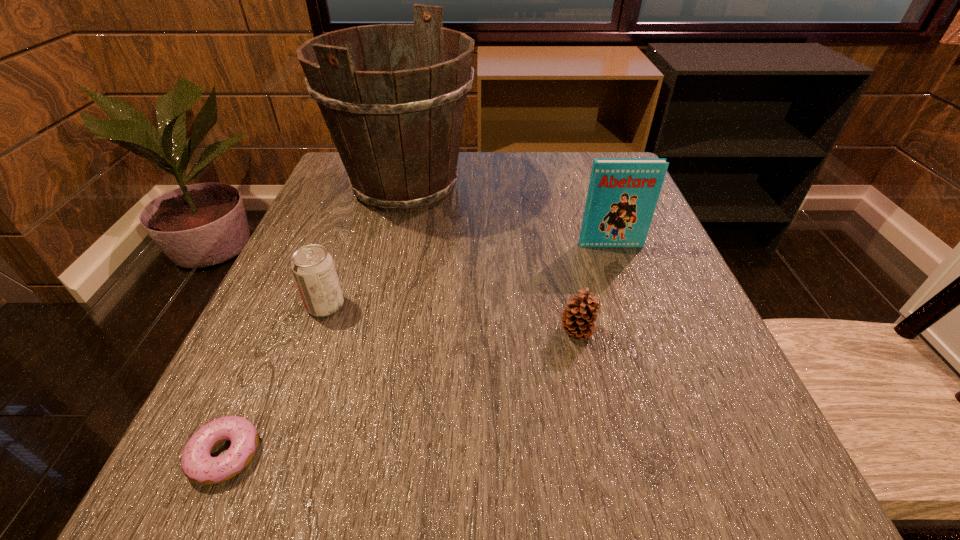
The image size is (960, 540). Find the location of `vacant point that satisfies the following two spatial constraints: 1. on the front side of the bucket; 2. on the left side of the second shortest object`. vacant point that satisfies the following two spatial constraints: 1. on the front side of the bucket; 2. on the left side of the second shortest object is located at coordinates (370, 332).

You are a GUI agent. You are given a task and a screenshot of the screen. Output one action in this format:
    pyautogui.click(x=<x>, y=<y>)
    Task: Click on the free space that satisfies the following two spatial constraints: 1. on the front side of the tallest object; 2. on the right side of the fourth tallest object
    The height and width of the screenshot is (540, 960).
    Given the screenshot: What is the action you would take?
    pyautogui.click(x=370, y=332)